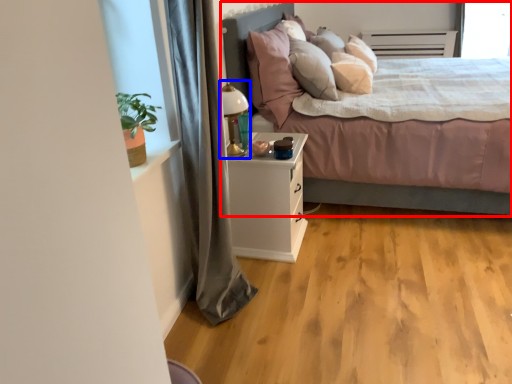
Question: Which object is further to the camera taking this photo, bed (highlighted by a red box) or table lamp (highlighted by a blue box)?

Choices:
 (A) bed
 (B) table lamp

Answer: (B)